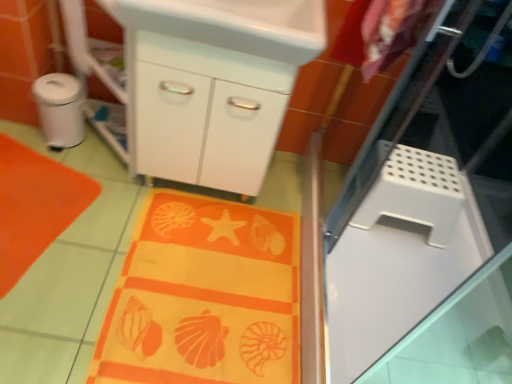
What do you see at coordinates (60, 109) in the screenshot? I see `white plastic trash can at left, which appears as the 1th appliance when viewed from the top` at bounding box center [60, 109].

Based on the photo, measure the distance between point (x=48, y=221) and camera.

The depth of point (x=48, y=221) is 5.10 feet.

Describe the element at coordinates (35, 206) in the screenshot. I see `orange fabric beach towel at lower left` at that location.

What is the approximate width of white perforated screen door at right?

white perforated screen door at right is 1.23 meters in width.

Locate an element on the screen. The width and height of the screenshot is (512, 384). white plastic step stool at right, which is counted as the first appliance, starting from the right is located at coordinates (415, 193).

Where is `orange fabric at lower center`? orange fabric at lower center is located at coordinates (204, 297).

Is white plastic trash can at left, which is the second appliance in bottom-to-top order, oriented away from white glossy cabinet at center?

That's not correct — white plastic trash can at left, which is the second appliance in bottom-to-top order, is not looking away from white glossy cabinet at center.

The height and width of the screenshot is (384, 512). In the image, there is a white plastic trash can at left, which is the second appliance in bottom-to-top order. In order to click on cabinetry below it (from the image's perspective) in this screenshot , I will do `click(206, 112)`.

Considering the relative sizes of white plastic trash can at left, which appears as the 1th appliance when viewed from the top, and white glossy cabinet at center in the image provided, is white plastic trash can at left, which appears as the 1th appliance when viewed from the top, smaller than white glossy cabinet at center?

Indeed, white plastic trash can at left, which appears as the 1th appliance when viewed from the top, has a smaller size compared to white glossy cabinet at center.

Can you confirm if white plastic trash can at left, which appears as the 1th appliance when viewed from the top, is positioned to the left of white glossy cabinet at center?

Yes.

Which point is more forward, (364, 206) or (339, 273)?

Point (339, 273)

From a real-world perspective, which is physically below, white plastic step stool at right, which ranks as the second appliance in left-to-right order, or white perforated screen door at right?

In real-world perspective, white plastic step stool at right, which ranks as the second appliance in left-to-right order, is lower.

Considering the sizes of objects white plastic step stool at right, the 1th appliance from the bottom, and white perforated screen door at right in the image provided, who is shorter, white plastic step stool at right, the 1th appliance from the bottom, or white perforated screen door at right?

white plastic step stool at right, the 1th appliance from the bottom, is shorter.

Is white plastic step stool at right, which ranks as the second appliance in left-to-right order, far away from white perforated screen door at right?

No, white plastic step stool at right, which ranks as the second appliance in left-to-right order, is not far away from white perforated screen door at right.

Is orange fabric beach towel at lower left directly adjacent to orange fabric at lower center?

No.

Locate an element on the screen. beach towel above the orange fabric at lower center (from a real-world perspective) is located at coordinates (35, 206).

Consider the image. From a real-world perspective, is orange fabric beach towel at lower left on top of orange fabric at lower center?

Indeed, from a real-world perspective, orange fabric beach towel at lower left stands above orange fabric at lower center.

Which object is thinner, orange fabric beach towel at lower left or orange fabric at lower center?

orange fabric beach towel at lower left is thinner.

From a real-world perspective, between white glossy sink at upper center and orange fabric beach towel at lower left, who is vertically higher?

In real-world perspective, white glossy sink at upper center is above.

Does white glossy sink at upper center have a larger size compared to orange fabric beach towel at lower left?

Yes, white glossy sink at upper center is bigger than orange fabric beach towel at lower left.

How different are the orientations of white glossy sink at upper center and orange fabric beach towel at lower left in degrees?

There is a 72.7-degree angle between the facing directions of white glossy sink at upper center and orange fabric beach towel at lower left.

Is white glossy sink at upper center positioned with its back to orange fabric beach towel at lower left?

No, white glossy sink at upper center is not facing the opposite direction of orange fabric beach towel at lower left.

Considering the sizes of objects orange fabric at lower center and white plastic step stool at right, placed as the second appliance when sorted from top to bottom, in the image provided, who is taller, orange fabric at lower center or white plastic step stool at right, placed as the second appliance when sorted from top to bottom,?

With more height is white plastic step stool at right, placed as the second appliance when sorted from top to bottom.

Is orange fabric at lower center smaller than white plastic step stool at right, which ranks as the second appliance in left-to-right order?

Correct, orange fabric at lower center occupies less space than white plastic step stool at right, which ranks as the second appliance in left-to-right order.

Does point (151, 283) come closer to viewer compared to point (404, 206)?

Yes.

From the image's perspective, count 1st appliances upward from the orange fabric at lower center and point to it. Please provide its 2D coordinates.

[(415, 193)]

Consider the image. Is white glossy sink at upper center turned away from white plastic step stool at right, placed as the second appliance when sorted from top to bottom?

white glossy sink at upper center does not have its back to white plastic step stool at right, placed as the second appliance when sorted from top to bottom.

Considering the relative sizes of white glossy sink at upper center and white plastic step stool at right, which ranks as the second appliance in left-to-right order, in the image provided, is white glossy sink at upper center thinner than white plastic step stool at right, which ranks as the second appliance in left-to-right order,?

No, white glossy sink at upper center is not thinner than white plastic step stool at right, which ranks as the second appliance in left-to-right order.

Is point (248, 24) positioned after point (442, 228)?

No, it is in front of (442, 228).

Does white glossy sink at upper center come in front of white plastic step stool at right, which is counted as the first appliance, starting from the right?

Yes, white glossy sink at upper center is in front of white plastic step stool at right, which is counted as the first appliance, starting from the right.

Is white plastic trash can at left, the 2th appliance viewed from the right, completely or partially inside orange fabric beach towel at lower left?

That's incorrect, white plastic trash can at left, the 2th appliance viewed from the right, is not inside orange fabric beach towel at lower left.

From the orange fabric beach towel at lower left, count 2nd appliances backward and point to it. Please provide its 2D coordinates.

[(60, 109)]

Between orange fabric beach towel at lower left and white plastic trash can at left, the 2th appliance viewed from the right, which one has smaller width?

white plastic trash can at left, the 2th appliance viewed from the right, is thinner.

I want to click on cabinetry lying in front of the white plastic trash can at left, the 2th appliance viewed from the right, so point(206,112).

Locate an element on the screen. This screenshot has width=512, height=384. screen door above the white plastic step stool at right, which is counted as the first appliance, starting from the right (from the image's perspective) is located at coordinates (429, 216).

From the image, which object appears to be nearer to white glossy sink at upper center, white perforated screen door at right or orange fabric at lower center?

Among the two, white perforated screen door at right is located nearer to white glossy sink at upper center.

From the image, which object appears to be nearer to white glossy sink at upper center, orange fabric at lower center or white plastic step stool at right, which is counted as the first appliance, starting from the right?

Among the two, white plastic step stool at right, which is counted as the first appliance, starting from the right, is located nearer to white glossy sink at upper center.

Which object lies further to the anchor point orange fabric at lower center, white perforated screen door at right or white glossy cabinet at center?

Among the two, white perforated screen door at right is located further to orange fabric at lower center.

Considering their positions, is white glossy cabinet at center positioned further to white plastic trash can at left, which appears as the 1th appliance when viewed from the top, than orange fabric beach towel at lower left?

The object further to white plastic trash can at left, which appears as the 1th appliance when viewed from the top, is white glossy cabinet at center.

Which object lies further to the anchor point white glossy cabinet at center, orange fabric beach towel at lower left or white perforated screen door at right?

white perforated screen door at right is positioned further to the anchor white glossy cabinet at center.

In the scene shown: Looking at the image, which one is located closer to white perforated screen door at right, white plastic trash can at left, the 2th appliance viewed from the right, or orange fabric at lower center?

Among the two, orange fabric at lower center is located nearer to white perforated screen door at right.

In the scene shown: When comparing their distances from white perforated screen door at right, does orange fabric at lower center or white plastic step stool at right, the 1th appliance from the bottom, seem further?

orange fabric at lower center is positioned further to the anchor white perforated screen door at right.

Estimate the real-world distances between objects in this image. Which object is further from orange fabric at lower center, white perforated screen door at right or orange fabric beach towel at lower left?

white perforated screen door at right.

I want to click on sink between orange fabric beach towel at lower left and white plastic step stool at right, which ranks as the second appliance in left-to-right order, so click(x=233, y=24).

This screenshot has width=512, height=384. Find the location of `blanket located between white plastic trash can at left, acting as the first appliance starting from the left, and white perforated screen door at right in the left-right direction`. blanket located between white plastic trash can at left, acting as the first appliance starting from the left, and white perforated screen door at right in the left-right direction is located at coordinates (204, 297).

Identify the location of appliance between orange fabric beach towel at lower left and orange fabric at lower center in the horizontal direction. Image resolution: width=512 pixels, height=384 pixels. (60, 109).

Where is `appliance located between orange fabric beach towel at lower left and white glossy cabinet at center in the left-right direction`? This screenshot has width=512, height=384. appliance located between orange fabric beach towel at lower left and white glossy cabinet at center in the left-right direction is located at coordinates (60, 109).